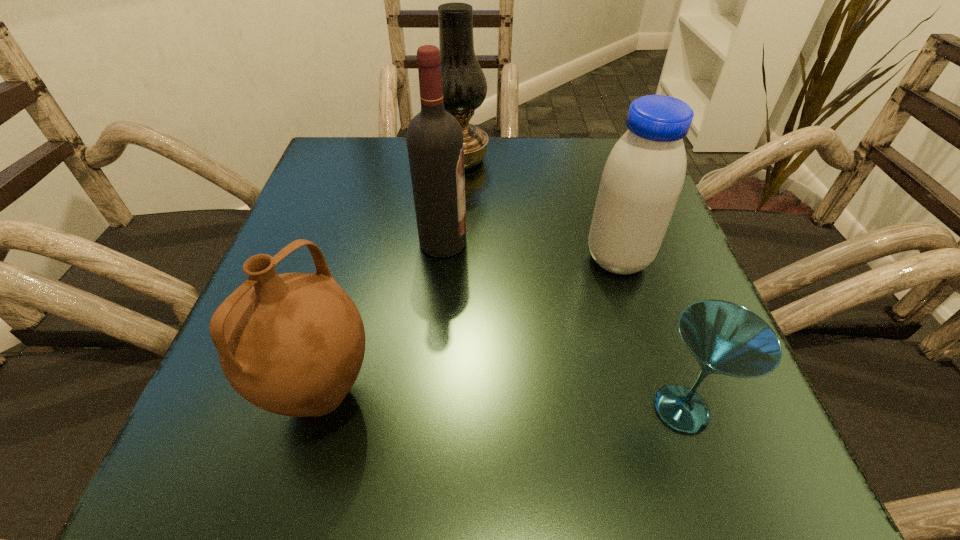
Image resolution: width=960 pixels, height=540 pixels. I want to click on wine bottle, so click(435, 144).

Image resolution: width=960 pixels, height=540 pixels. What are the coordinates of `oil lamp` in the screenshot? It's located at [x=464, y=84].

Locate an element on the screen. The width and height of the screenshot is (960, 540). soya milk is located at coordinates (643, 177).

You are a GUI agent. You are given a task and a screenshot of the screen. Output one action in this format:
    pyautogui.click(x=<x>, y=<y>)
    Task: Click on the leftmost object
    Image resolution: width=960 pixels, height=540 pixels.
    Given the screenshot: What is the action you would take?
    click(x=293, y=344)

Find the location of a particular element. The image size is (960, 540). martini is located at coordinates (725, 338).

Find the location of a particular element. The width and height of the screenshot is (960, 540). vacant space located 0.310m on the label of the wine bottle is located at coordinates (636, 242).

Locate an element on the screen. The image size is (960, 540). blank area located 0.270m on the front of the oil lamp is located at coordinates (455, 261).

Find the location of a particular element. The image size is (960, 540). free space located on the back of the soya milk is located at coordinates (602, 208).

Where is `vacant space located 0.080m on the back of the leftmost object`? The width and height of the screenshot is (960, 540). vacant space located 0.080m on the back of the leftmost object is located at coordinates (347, 306).

Where is `free space located on the back of the shortest object`? The image size is (960, 540). free space located on the back of the shortest object is located at coordinates (660, 346).